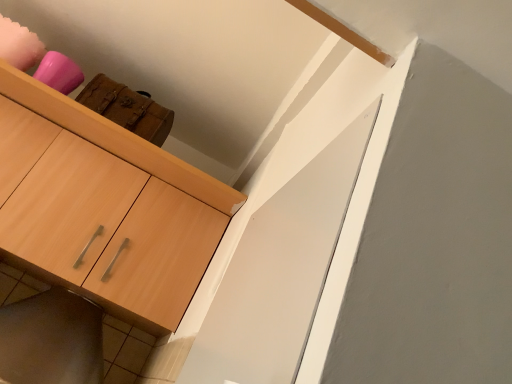
You are a GUI agent. You are given a task and a screenshot of the screen. Output one action in this format:
    pyautogui.click(x=<x>, y=<y>)
    Task: Click on the blank space situated above wooden cabinet at lower left (from a real-world perspective)
    The height and width of the screenshot is (384, 512).
    Given the screenshot: What is the action you would take?
    pyautogui.click(x=69, y=284)